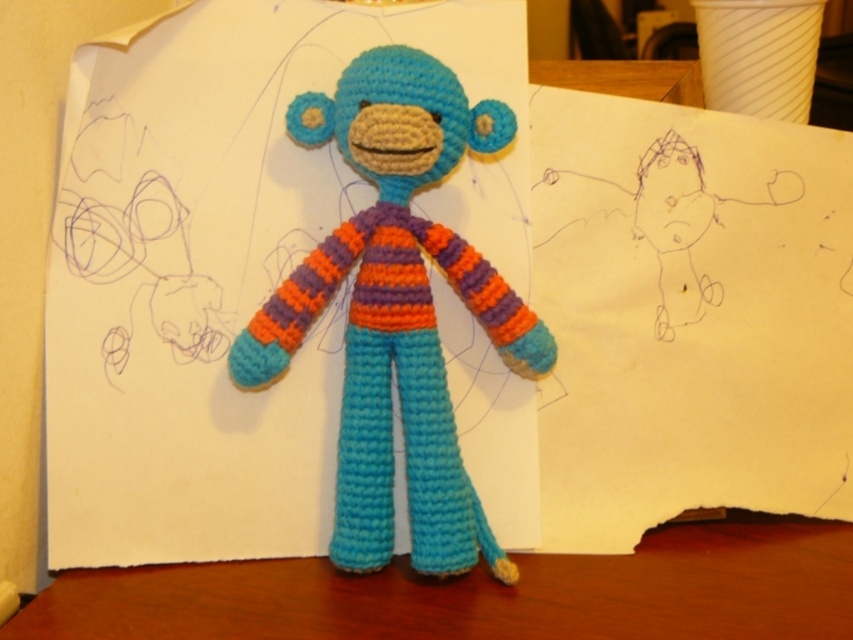
Question: Among these points, which one is farthest from the camera?

Choices:
 (A) (828, 524)
 (B) (299, 323)

Answer: (B)

Question: Which object appears farthest from the camera in this image?

Choices:
 (A) knitted yarn monkey at center
 (B) wooden table at center

Answer: (A)

Question: Can you confirm if knitted yarn monkey at center is wider than wooden table at center?

Choices:
 (A) yes
 (B) no

Answer: (B)

Question: Which of the following is the closest to the observer?

Choices:
 (A) wooden table at center
 (B) knitted yarn monkey at center

Answer: (A)

Question: Does knitted yarn monkey at center have a larger size compared to wooden table at center?

Choices:
 (A) no
 (B) yes

Answer: (B)

Question: Is knitted yarn monkey at center thinner than wooden table at center?

Choices:
 (A) no
 (B) yes

Answer: (B)